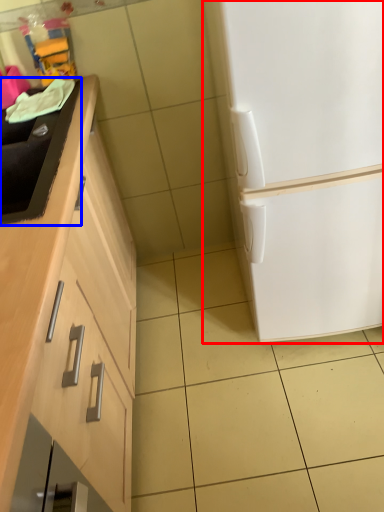
Question: Which of the following is the farthest to the observer, refrigerator (highlighted by a red box) or sink (highlighted by a blue box)?

Choices:
 (A) refrigerator
 (B) sink

Answer: (B)